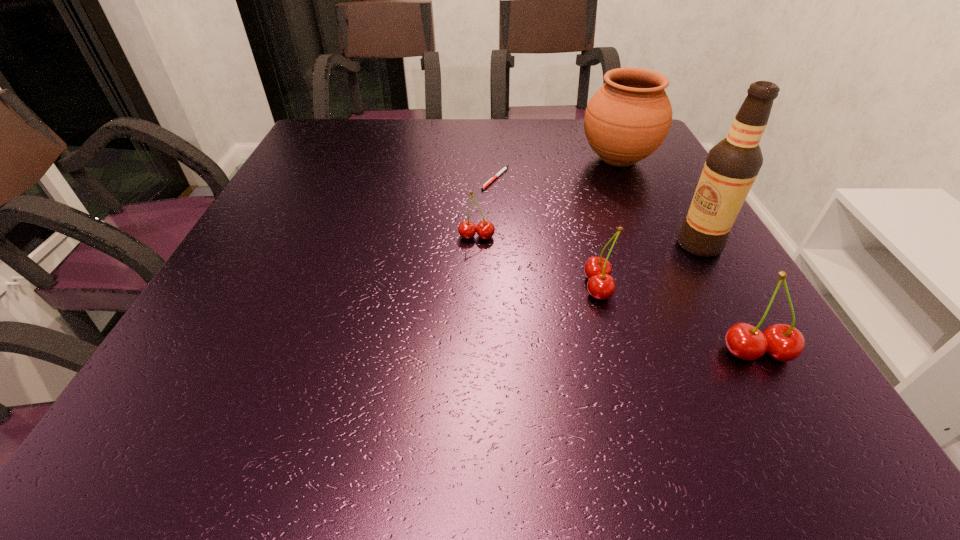
Locate an element on the screen. This screenshot has width=960, height=540. vacant region located 0.140m with the stems of the second nearest cherry pointing upwards is located at coordinates (507, 287).

Find the location of a particular element. blank space located with the stems of the second nearest cherry pointing upwards is located at coordinates (436, 287).

Where is `free space located with the stems of the second nearest cherry pointing upwards`? free space located with the stems of the second nearest cherry pointing upwards is located at coordinates (540, 287).

This screenshot has width=960, height=540. In order to click on vacant space positioned on the front of the pottery in this screenshot , I will do coord(660,251).

Locate an element on the screen. vacant space located 0.180m on the clicker of the pen is located at coordinates (498, 238).

Locate an element on the screen. The width and height of the screenshot is (960, 540). blank space located on the label of the alcohol is located at coordinates (613, 245).

Locate an element on the screen. The width and height of the screenshot is (960, 540). vacant region located on the label of the alcohol is located at coordinates (603, 245).

Locate an element on the screen. Image resolution: width=960 pixels, height=540 pixels. free spot located on the label of the alcohol is located at coordinates (613, 245).

You are a GUI agent. You are given a task and a screenshot of the screen. Output one action in this format:
    pyautogui.click(x=<x>, y=<y>)
    Task: Click on the object that is positioned at the far edge
    
    Given the screenshot: What is the action you would take?
    pyautogui.click(x=628, y=118)

Locate an element on the screen. The height and width of the screenshot is (540, 960). object that is positioned at the near edge is located at coordinates (784, 343).